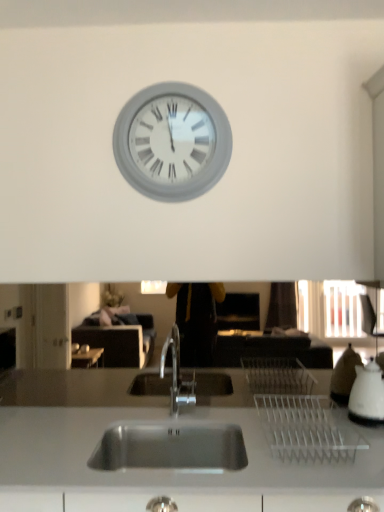
Measure the distance between white matte clock at upper center and camera.

They are 1.85 meters apart.

Locate an element on the screen. This screenshot has height=512, width=384. white matte clock at upper center is located at coordinates [x=172, y=142].

The width and height of the screenshot is (384, 512). What do you see at coordinates (172, 142) in the screenshot? I see `white matte clock at upper center` at bounding box center [172, 142].

Image resolution: width=384 pixels, height=512 pixels. What do you see at coordinates (367, 393) in the screenshot?
I see `white glossy kettle at right` at bounding box center [367, 393].

In order to face white glossy kettle at right, should I rotate leftwards or rightwards?

Rotate right and turn 22.489 degrees.

This screenshot has height=512, width=384. In order to click on white glossy kettle at right in this screenshot , I will do `click(367, 393)`.

This screenshot has width=384, height=512. I want to click on white matte clock at upper center, so click(172, 142).

Between white matte clock at upper center and white glossy kettle at right, which one appears on the right side from the viewer's perspective?

Positioned to the right is white glossy kettle at right.

Which object is further away from the camera taking this photo, white matte clock at upper center or white glossy kettle at right?

white matte clock at upper center is further away from the camera.

Which is less distant, (157, 195) or (367, 375)?

Point (367, 375)

From the image's perspective, which is above, white matte clock at upper center or white glossy kettle at right?

white matte clock at upper center.

From a real-world perspective, is white matte clock at upper center on top of white glossy kettle at right?

Yes, from a real-world perspective, white matte clock at upper center is on top of white glossy kettle at right.

Considering the sizes of white matte clock at upper center and white glossy kettle at right in the image, is white matte clock at upper center wider or thinner than white glossy kettle at right?

Clearly, white matte clock at upper center has less width compared to white glossy kettle at right.

Considering the relative sizes of white matte clock at upper center and white glossy kettle at right in the image provided, is white matte clock at upper center shorter than white glossy kettle at right?

In fact, white matte clock at upper center may be taller than white glossy kettle at right.

Between white matte clock at upper center and white glossy kettle at right, which one has larger size?

white matte clock at upper center.

Looking at this image, is white matte clock at upper center surrounding white glossy kettle at right?

No, white glossy kettle at right is not inside white matte clock at upper center.

Is white matte clock at upper center far away from white glossy kettle at right?

That's right, there is a large distance between white matte clock at upper center and white glossy kettle at right.

Is white matte clock at upper center looking in the opposite direction of white glossy kettle at right?

No, white matte clock at upper center is not facing the opposite direction of white glossy kettle at right.

How different are the orientations of white matte clock at upper center and white glossy kettle at right in degrees?

The angle between the facing direction of white matte clock at upper center and the facing direction of white glossy kettle at right is 1.24 degrees.

Where is `appliance lying below the white matte clock at upper center (from the image's perspective)`? This screenshot has width=384, height=512. appliance lying below the white matte clock at upper center (from the image's perspective) is located at coordinates (367, 393).

Does white glossy kettle at right appear on the left side of white matte clock at upper center?

No.

Between white glossy kettle at right and white matte clock at upper center, which one is positioned in front?

white glossy kettle at right.

Which is more distant, [375,374] or [190,158]?

The point [190,158] is farther.

From the image's perspective, is white glossy kettle at right above or below white matte clock at upper center?

From the image's perspective, white glossy kettle at right appears below white matte clock at upper center.

From a real-world perspective, is white glossy kettle at right under white matte clock at upper center?

Yes, from a real-world perspective, white glossy kettle at right is below white matte clock at upper center.

Between white glossy kettle at right and white matte clock at upper center, which one has smaller width?

white matte clock at upper center is thinner.

Can you confirm if white glossy kettle at right is shorter than white matte clock at upper center?

Correct, white glossy kettle at right is not as tall as white matte clock at upper center.

Between white glossy kettle at right and white matte clock at upper center, which one has larger size?

Bigger between the two is white matte clock at upper center.

Is white glossy kettle at right completely or partially outside of white matte clock at upper center?

Yes.

Would you say white glossy kettle at right is a long distance from white matte clock at upper center?

That's right, there is a large distance between white glossy kettle at right and white matte clock at upper center.

Is white glossy kettle at right oriented towards white matte clock at upper center?

No, white glossy kettle at right is not facing towards white matte clock at upper center.

What's the angular difference between white glossy kettle at right and white matte clock at upper center's facing directions?

They differ by 1.24 degrees in their facing directions.

In the image, there is a white glossy kettle at right. Where is `wall clock above it (from the image's perspective)`? The width and height of the screenshot is (384, 512). wall clock above it (from the image's perspective) is located at coordinates click(x=172, y=142).

Identify the location of appliance beneath the white matte clock at upper center (from a real-world perspective). (367, 393).

The image size is (384, 512). I want to click on wall clock above the white glossy kettle at right (from the image's perspective), so click(172, 142).